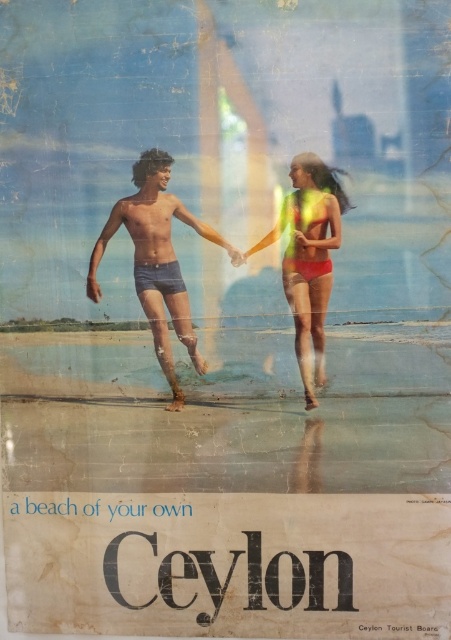
You are a photographer trying to capture the reflections of the blue denim shorts at center and the matte yellow bikini at center on the wet sand. Since reflections depend on the object size, which one do you think will have a larger reflection?

The blue denim shorts at center is larger in size than the matte yellow bikini at center, so its reflection will also be larger.

You are a photographer standing at the center of the beach scene in the vintage travel poster of Ceylon. You want to take a photo that includes both the point at coordinates point (141, 276) and point (308, 192). Which point should you focus on first to ensure both are in focus?

You should focus on point (141, 276) first because it is closer to you than point (308, 192), which is further away. By focusing on the closer point, the further point will also be in focus due to the depth of field.

You are a photographer positioned at the edge of the beach. You want to capture a photo of both the blue denim shorts at center and the matte yellow bikini at center. Which object will appear larger in the photo?

The blue denim shorts at center will appear larger in the photo because it is closer to the photographer than the matte yellow bikini at center.